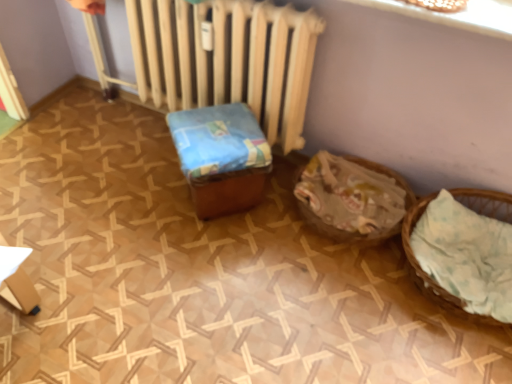
Question: Can you confirm if blue fabric-covered box at center is taller than white matte radiator at center?

Choices:
 (A) no
 (B) yes

Answer: (A)

Question: Is blue fabric-covered box at center looking in the opposite direction of white matte radiator at center?

Choices:
 (A) no
 (B) yes

Answer: (B)

Question: Is blue fabric-covered box at center next to white matte radiator at center and touching it?

Choices:
 (A) no
 (B) yes

Answer: (A)

Question: Is blue fabric-covered box at center further to camera compared to white matte radiator at center?

Choices:
 (A) no
 (B) yes

Answer: (B)

Question: Is blue fabric-covered box at center completely or partially outside of white matte radiator at center?

Choices:
 (A) no
 (B) yes

Answer: (B)

Question: Based on their sizes in the image, would you say blue fabric-covered box at center is bigger or smaller than light brown woven basket at right, arranged as the 2th basket when viewed from the left?

Choices:
 (A) small
 (B) big

Answer: (B)

Question: Is blue fabric-covered box at center taller or shorter than light brown woven basket at right, arranged as the 1th basket when viewed from the right?

Choices:
 (A) tall
 (B) short

Answer: (A)

Question: Based on their positions, is blue fabric-covered box at center located to the left or right of light brown woven basket at right, arranged as the 1th basket when viewed from the right?

Choices:
 (A) right
 (B) left

Answer: (B)

Question: From a real-world perspective, is blue fabric-covered box at center positioned above or below light brown woven basket at right, arranged as the 1th basket when viewed from the right?

Choices:
 (A) below
 (B) above

Answer: (B)

Question: Visually, is brown woven basket at lower right, arranged as the first basket when viewed from the left, positioned to the left or to the right of blue fabric-covered box at center?

Choices:
 (A) left
 (B) right

Answer: (B)

Question: Is brown woven basket at lower right, the second basket positioned from the right, bigger or smaller than blue fabric-covered box at center?

Choices:
 (A) small
 (B) big

Answer: (A)

Question: Is brown woven basket at lower right, arranged as the first basket when viewed from the left, wider or thinner than blue fabric-covered box at center?

Choices:
 (A) thin
 (B) wide

Answer: (B)

Question: Relative to blue fabric-covered box at center, is brown woven basket at lower right, arranged as the first basket when viewed from the left, in front or behind?

Choices:
 (A) front
 (B) behind

Answer: (B)

Question: Is light brown woven basket at right, arranged as the 2th basket when viewed from the left, wider or thinner than blue fabric-covered box at center?

Choices:
 (A) wide
 (B) thin

Answer: (A)

Question: From the image's perspective, is light brown woven basket at right, arranged as the 1th basket when viewed from the right, positioned above or below blue fabric-covered box at center?

Choices:
 (A) above
 (B) below

Answer: (B)